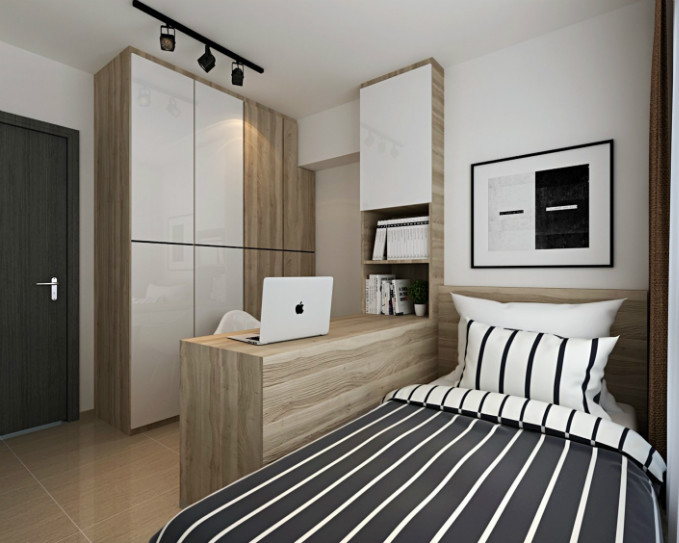
Locate an element on the screen. desk is located at coordinates (220, 400), (341, 376).